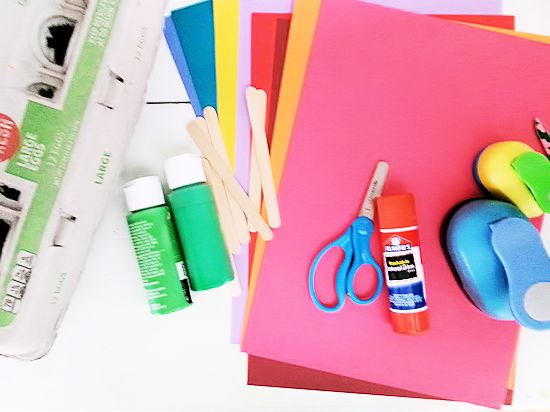
At what (x,y) coordinates should I click in order to perform the action: click on paint. Please return your answer as a coordinate pair (x, y). This screenshot has height=412, width=550. Looking at the image, I should click on (150, 248), (209, 235).